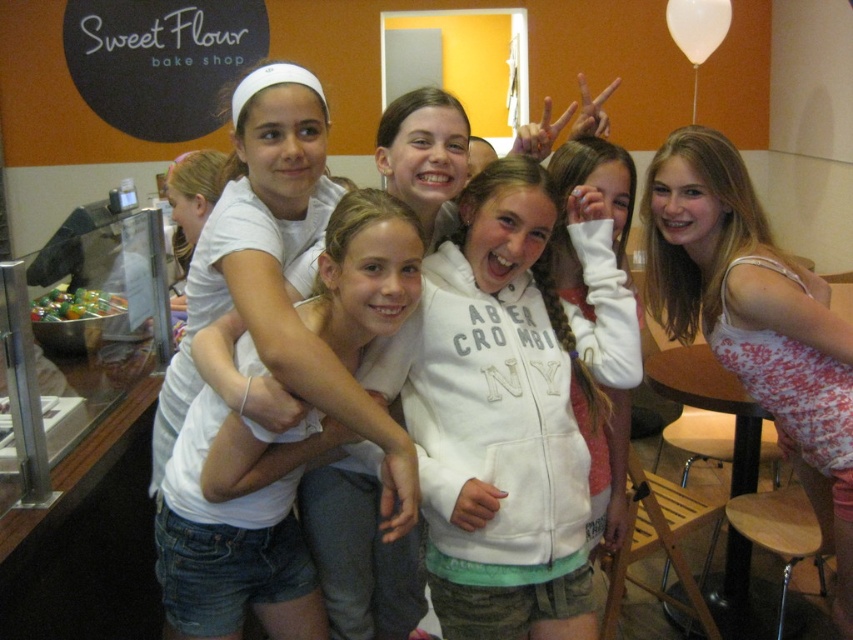
Question: Which point is farther to the camera?

Choices:
 (A) (231, 531)
 (B) (734, 314)

Answer: (B)

Question: Which object is closer to the camera taking this photo?

Choices:
 (A) pink floral tank top at right
 (B) jeans at center

Answer: (B)

Question: Is pink floral tank top at right bigger than jeans at center?

Choices:
 (A) yes
 (B) no

Answer: (A)

Question: Can you confirm if pink floral tank top at right is positioned above jeans at center?

Choices:
 (A) no
 (B) yes

Answer: (B)

Question: Which point is farther from the camera taking this photo?

Choices:
 (A) (264, 573)
 (B) (724, 164)

Answer: (B)

Question: Can you confirm if pink floral tank top at right is positioned above jeans at center?

Choices:
 (A) no
 (B) yes

Answer: (B)